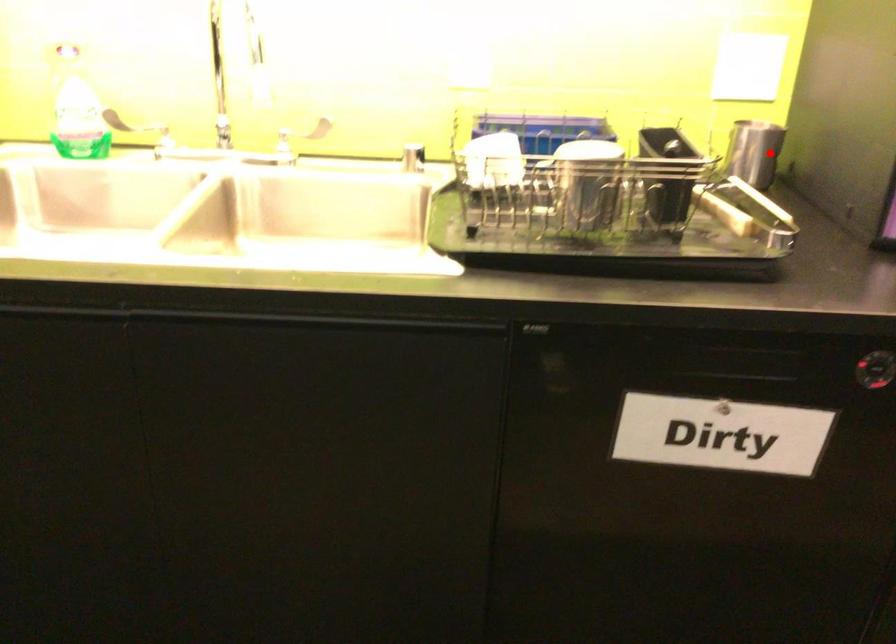
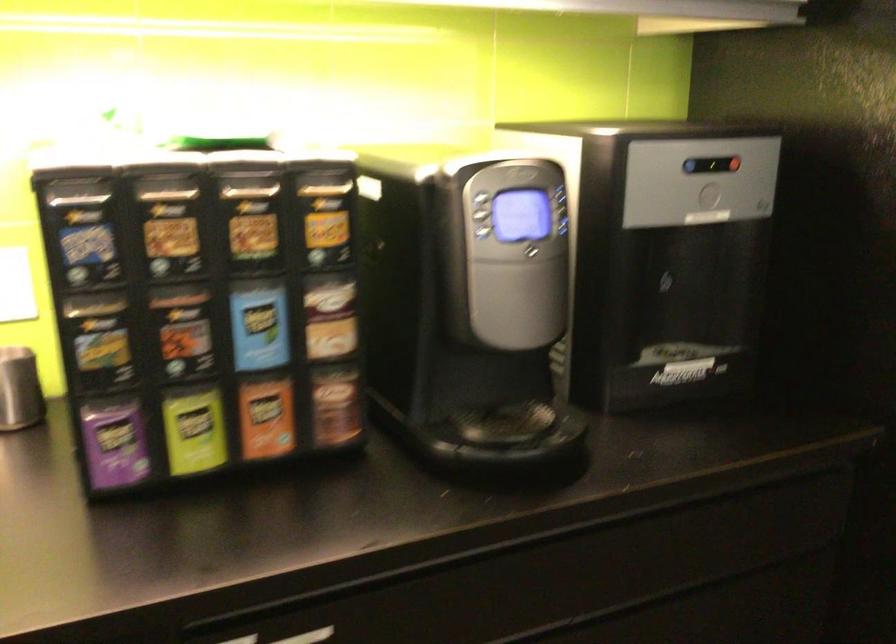
Where in the second image is the point corresponding to the highlighted location from the first image?

(19, 389)